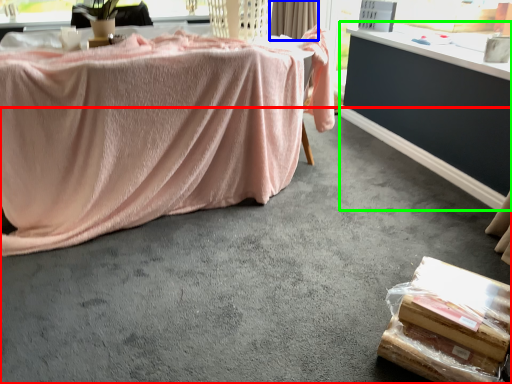
Question: Which is nearer to the concrete (highlighted by a red box)? curtain (highlighted by a blue box) or table (highlighted by a green box).

Choices:
 (A) curtain
 (B) table

Answer: (B)